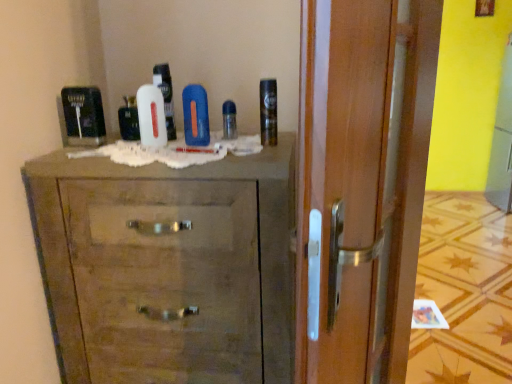
Image resolution: width=512 pixels, height=384 pixels. In order to click on free space in front of blue glossy mouthwash at center, the second mouthwash when ordered from left to right in this screenshot , I will do `click(209, 147)`.